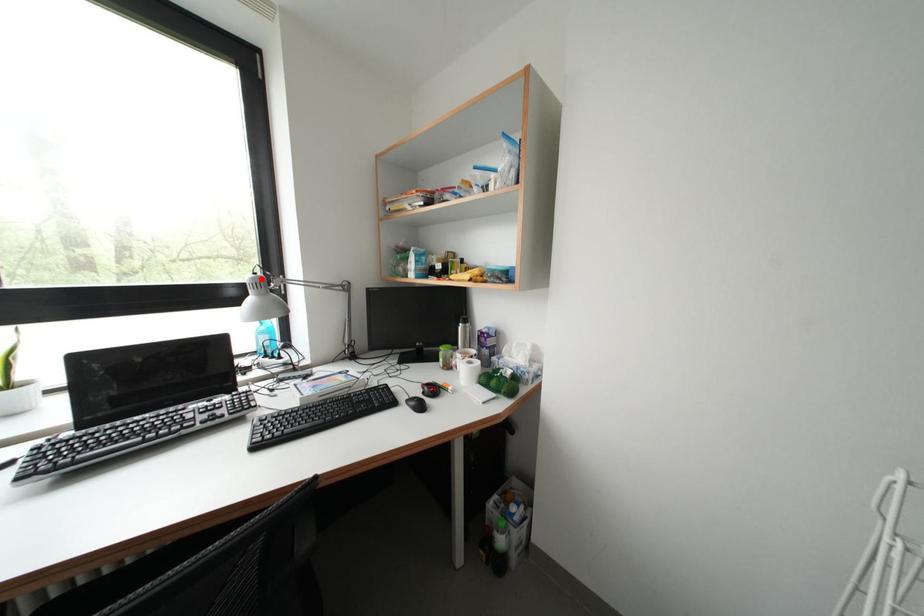
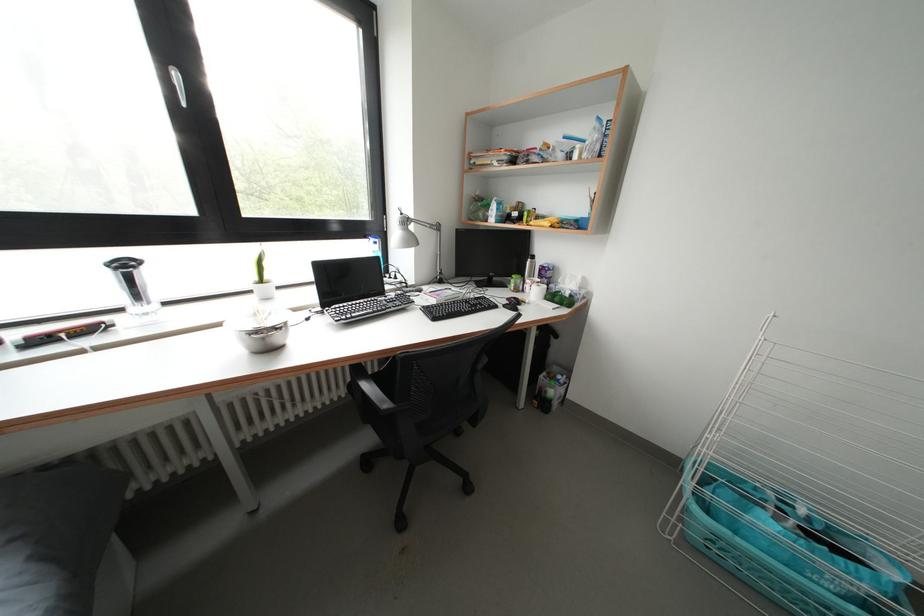
Locate, in the second image, the point that corresponds to the highlighted location in the first image.

(408, 219)